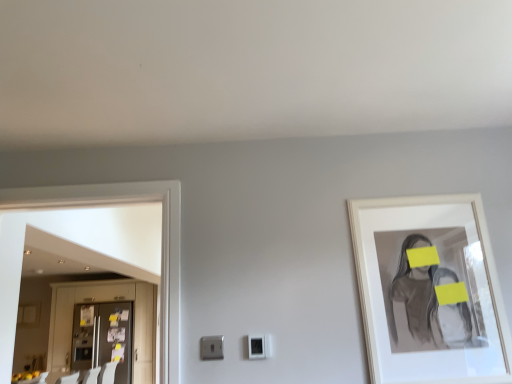
Question: Can you see metallic refrigerator at left touching white plastic electric outlet at center?

Choices:
 (A) no
 (B) yes

Answer: (A)

Question: Can you confirm if metallic refrigerator at left is bigger than white plastic electric outlet at center?

Choices:
 (A) yes
 (B) no

Answer: (A)

Question: Is white plastic electric outlet at center surrounded by metallic refrigerator at left?

Choices:
 (A) yes
 (B) no

Answer: (B)

Question: Is the depth of metallic refrigerator at left greater than that of white plastic electric outlet at center?

Choices:
 (A) no
 (B) yes

Answer: (B)

Question: Is metallic refrigerator at left wider than white plastic electric outlet at center?

Choices:
 (A) no
 (B) yes

Answer: (B)

Question: Considering the positions of matte gray cabinetry at left and white plastic electric outlet at center in the image, is matte gray cabinetry at left bigger or smaller than white plastic electric outlet at center?

Choices:
 (A) big
 (B) small

Answer: (A)

Question: From a real-world perspective, is matte gray cabinetry at left physically located above or below white plastic electric outlet at center?

Choices:
 (A) above
 (B) below

Answer: (B)

Question: From the image's perspective, is matte gray cabinetry at left located above or below white plastic electric outlet at center?

Choices:
 (A) above
 (B) below

Answer: (B)

Question: In terms of height, does matte gray cabinetry at left look taller or shorter compared to white plastic electric outlet at center?

Choices:
 (A) tall
 (B) short

Answer: (A)

Question: Based on their sizes in the image, would you say white plastic electric outlet at center is bigger or smaller than white matte picture frame at upper right?

Choices:
 (A) big
 (B) small

Answer: (B)

Question: Do you think white plastic electric outlet at center is within white matte picture frame at upper right, or outside of it?

Choices:
 (A) outside
 (B) inside

Answer: (A)

Question: From the image's perspective, relative to white matte picture frame at upper right, is white plastic electric outlet at center above or below?

Choices:
 (A) above
 (B) below

Answer: (B)

Question: Is white plastic electric outlet at center taller or shorter than white matte picture frame at upper right?

Choices:
 (A) short
 (B) tall

Answer: (A)

Question: Is point (99, 347) positioned closer to the camera than point (260, 336)?

Choices:
 (A) closer
 (B) farther

Answer: (B)

Question: Considering the positions of metallic refrigerator at left and white plastic electric outlet at center in the image, is metallic refrigerator at left wider or thinner than white plastic electric outlet at center?

Choices:
 (A) wide
 (B) thin

Answer: (A)